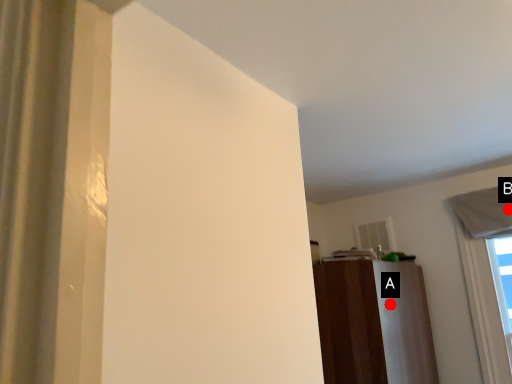
Question: Two points are circled on the image, labeled by A and B beside each circle. Which point appears closest to the camera in this image?

Choices:
 (A) A is closer
 (B) B is closer

Answer: (A)